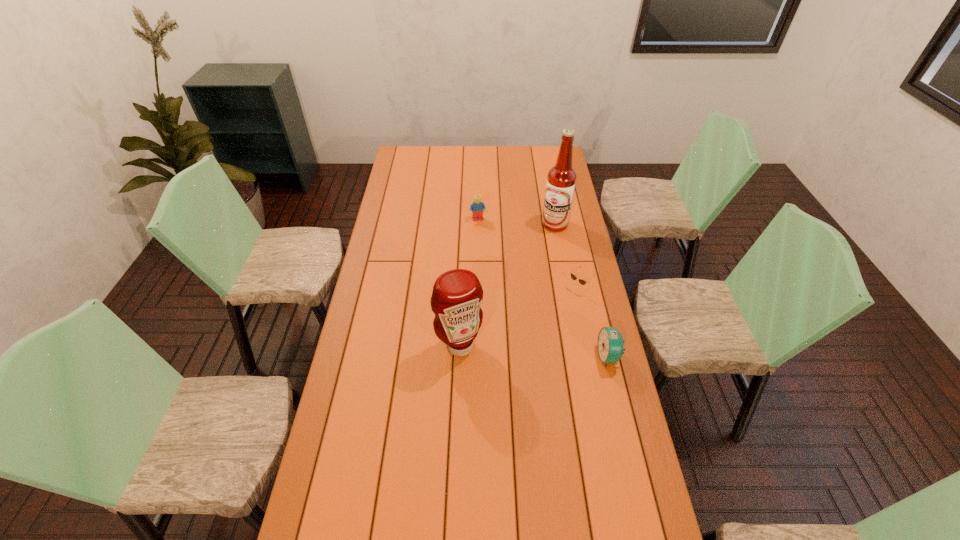
What are the coordinates of `vacant position in the image that satisfies the following two spatial constraints: 1. on the front side of the alarm clock; 2. on the front-facing side of the Lego` in the screenshot? It's located at (477, 356).

Find the location of a particular element. free space that satisfies the following two spatial constraints: 1. on the front side of the alarm clock; 2. on the front-facing side of the Lego is located at coordinates (477, 356).

At what (x,y) coordinates should I click in order to perform the action: click on vacant space that satisfies the following two spatial constraints: 1. on the front side of the fourth shortest object; 2. on the front-facing side of the alarm clock. Please return your answer as a coordinate pair (x, y). The image size is (960, 540). Looking at the image, I should click on (459, 356).